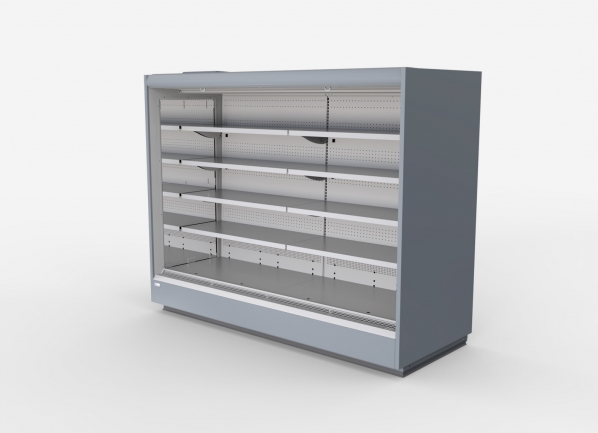
What are the coordinates of `second shelf` in the screenshot? It's located at (274, 244).